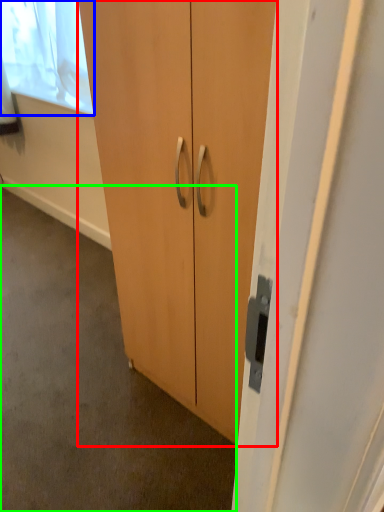
Question: Considering the real-world distances, which object is farthest from cupboard (highlighted by a red box)? window screen (highlighted by a blue box) or concrete (highlighted by a green box)?

Choices:
 (A) window screen
 (B) concrete

Answer: (A)